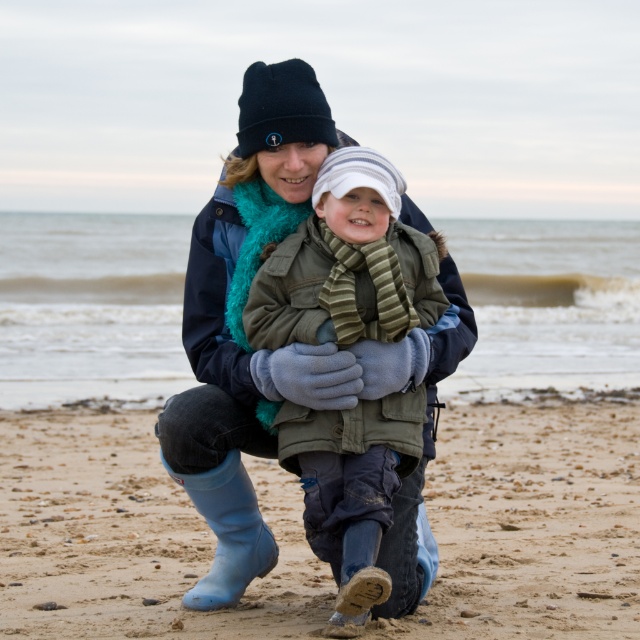
Does sandy brown at lower center have a greater height compared to striped knit hat at center?

No.

Does sandy brown at lower center have a lesser height compared to striped knit hat at center?

Correct, sandy brown at lower center is not as tall as striped knit hat at center.

Is point (90, 534) closer to viewer compared to point (419, 417)?

No, it is not.

Locate an element on the screen. The width and height of the screenshot is (640, 640). sandy brown at lower center is located at coordinates (132, 536).

How far apart are striped knit hat at center and rubber boots at lower left?

A distance of 36.25 inches exists between striped knit hat at center and rubber boots at lower left.

Can you confirm if striped knit hat at center is thinner than rubber boots at lower left?

No, striped knit hat at center is not thinner than rubber boots at lower left.

Between point (372, 456) and point (218, 602), which one is positioned behind?

The point (218, 602) is more distant.

Where is `striped knit hat at center`? striped knit hat at center is located at coordinates (348, 262).

Is sandy brown at lower center bigger than rubber boots at lower left?

Correct, sandy brown at lower center is larger in size than rubber boots at lower left.

I want to click on sandy brown at lower center, so point(132,536).

Is point (472, 602) in front of point (243, 540)?

Yes.

This screenshot has width=640, height=640. I want to click on sandy brown at lower center, so click(x=132, y=536).